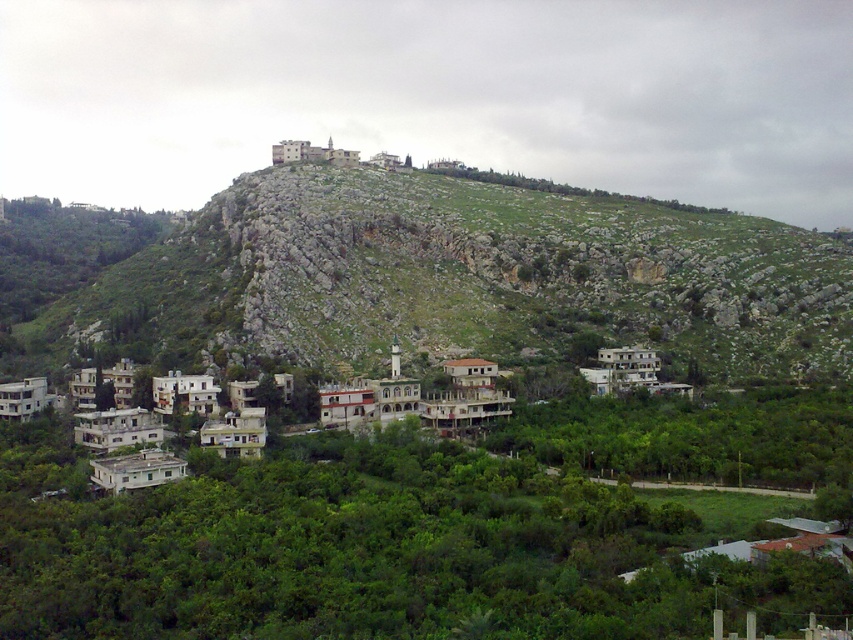
Question: Does green rocky mountain at upper center come behind white concrete buildings at lower left?

Choices:
 (A) yes
 (B) no

Answer: (A)

Question: Which of the following is the farthest from the observer?

Choices:
 (A) green rocky mountain at upper center
 (B) white concrete buildings at lower left

Answer: (A)

Question: Which point appears closest to the camera in this image?

Choices:
 (A) (161, 429)
 (B) (792, 237)

Answer: (A)

Question: Does green rocky mountain at upper center have a larger size compared to white concrete buildings at lower left?

Choices:
 (A) no
 (B) yes

Answer: (B)

Question: Is green rocky mountain at upper center wider than white concrete buildings at lower left?

Choices:
 (A) yes
 (B) no

Answer: (A)

Question: Among these objects, which one is farthest from the camera?

Choices:
 (A) white concrete buildings at lower left
 (B) green rocky mountain at upper center

Answer: (B)